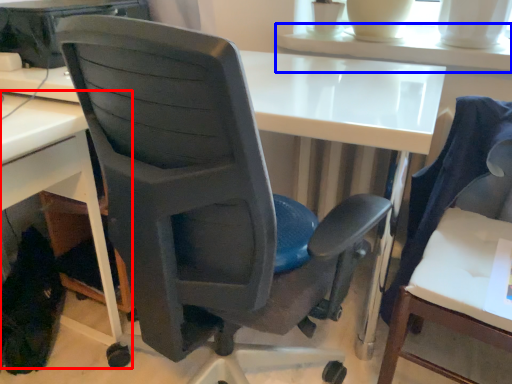
Question: Which of the following is the farthest to the observer, desk (highlighted by a red box) or table (highlighted by a blue box)?

Choices:
 (A) desk
 (B) table

Answer: (B)